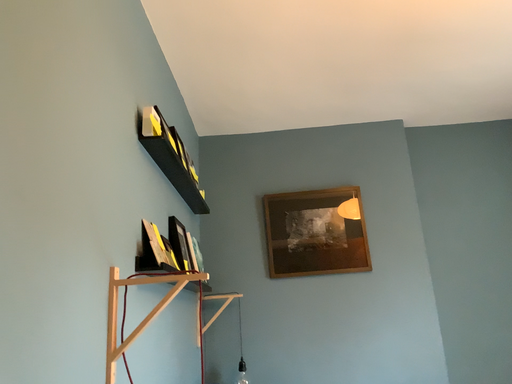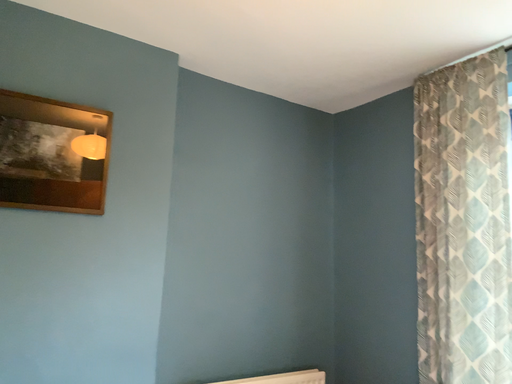
Question: Which way did the camera rotate in the video?

Choices:
 (A) rotated downward
 (B) rotated upward

Answer: (A)